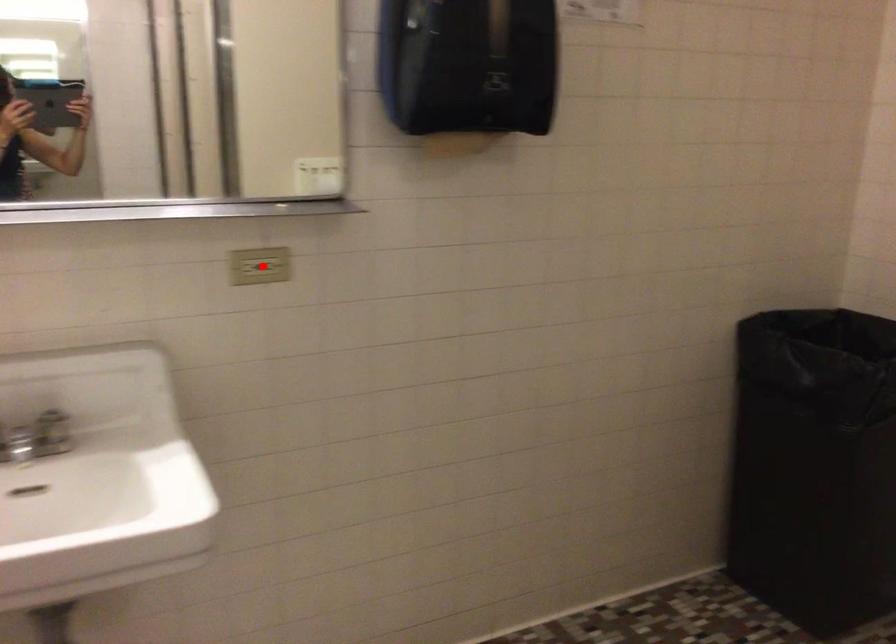
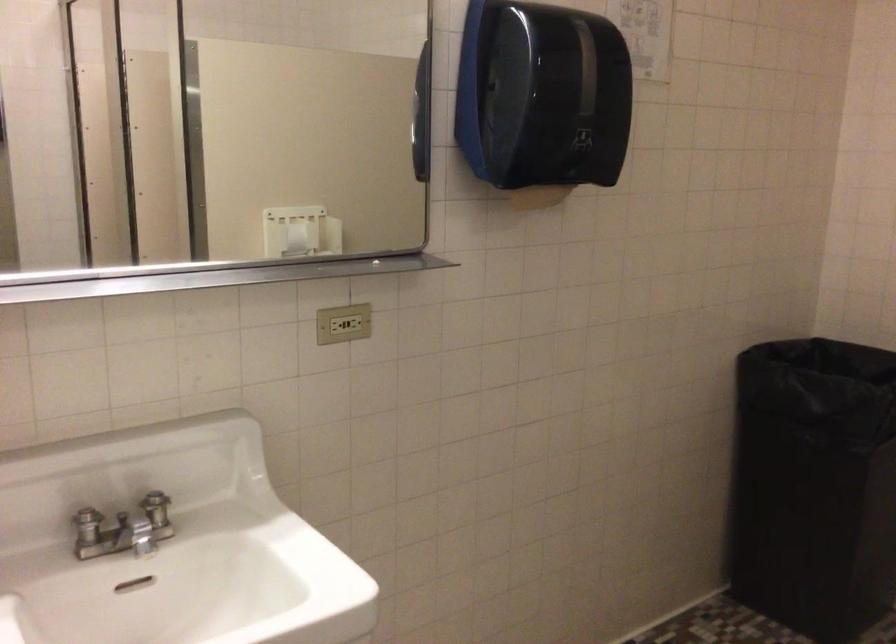
Locate, in the second image, the point that corresponds to the highlighted location in the first image.

(342, 323)